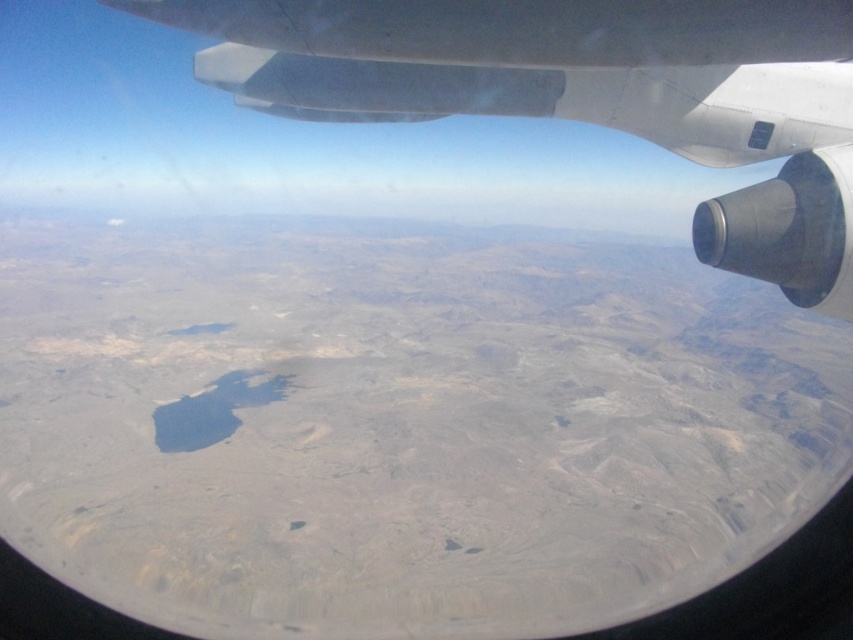
Which is behind, point (312, 61) or point (637, 51)?

Point (312, 61)

Does metallic gray wing at upper center come in front of smooth white wing at upper center?

No.

You are a GUI agent. You are given a task and a screenshot of the screen. Output one action in this format:
    pyautogui.click(x=<x>, y=<y>)
    Task: Click on the metallic gray wing at upper center
    The width and height of the screenshot is (853, 640).
    Given the screenshot: What is the action you would take?
    pyautogui.click(x=585, y=93)

Where is `metallic gray wing at upper center`? This screenshot has height=640, width=853. metallic gray wing at upper center is located at coordinates (585, 93).